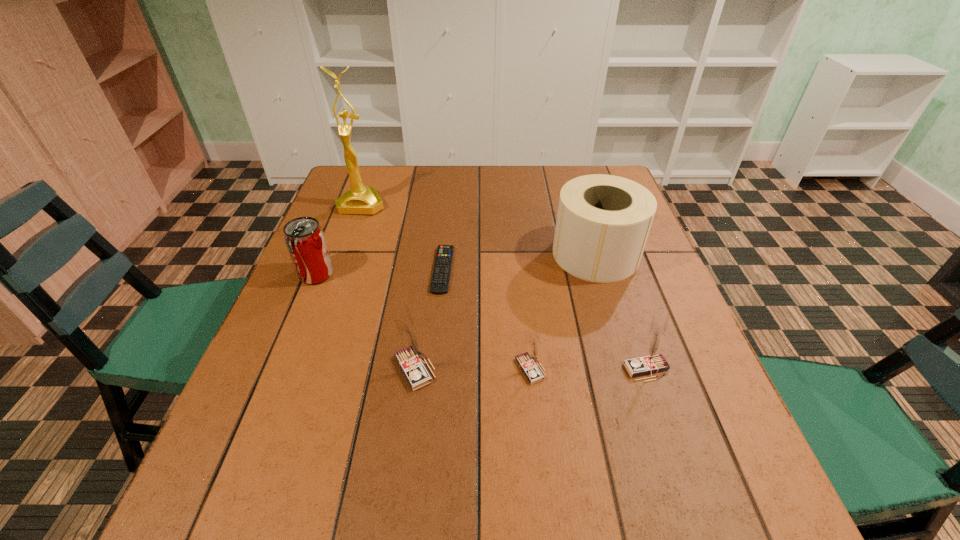
Where is `vacant point located between the tallest object and the rightmost matchbox`? This screenshot has width=960, height=540. vacant point located between the tallest object and the rightmost matchbox is located at coordinates (504, 287).

You are a GUI agent. You are given a task and a screenshot of the screen. Output one action in this format:
    pyautogui.click(x=<x>, y=<y>)
    Task: Click on the vacant region between the pop soda and the toilet tissue
    This screenshot has width=960, height=540.
    Given the screenshot: What is the action you would take?
    pyautogui.click(x=456, y=264)

Where is `free space between the second shortest matchbox and the toilet tissue`? This screenshot has width=960, height=540. free space between the second shortest matchbox and the toilet tissue is located at coordinates (621, 312).

The image size is (960, 540). What are the coordinates of `empty location between the leftmost matchbox and the pop soda` in the screenshot? It's located at (366, 322).

You are a GUI agent. You are given a task and a screenshot of the screen. Output one action in this format:
    pyautogui.click(x=<x>, y=<y>)
    Task: Click on the free spot between the leftmost matchbox and the toilet tissue
    
    Given the screenshot: What is the action you would take?
    pyautogui.click(x=505, y=312)

Where is `free spot between the pop soda and the rightmost matchbox`? The image size is (960, 540). free spot between the pop soda and the rightmost matchbox is located at coordinates pyautogui.click(x=481, y=322).

At what (x,y) coordinates should I click in order to perform the action: click on object that stands as the fifth closest to the tallest object. Please return your answer as a coordinate pair (x, y). The height and width of the screenshot is (540, 960). Looking at the image, I should click on (x=528, y=361).

Locate which object ranks in proximity to the second shortest matchbox. Please provide its 2D coordinates. Your answer should be formatted as a tuple, i.e. [(x, y)], where the tuple contains the x and y coordinates of a point satisfying the conditions above.

[(528, 361)]

At what (x,y) coordinates should I click in order to perform the action: click on the closest matchbox to the leftmost matchbox. Please return your answer as a coordinate pair (x, y). The width and height of the screenshot is (960, 540). Looking at the image, I should click on (528, 361).

Identify the location of matchbox that is the third closest one to the tallest object. Image resolution: width=960 pixels, height=540 pixels. (652, 361).